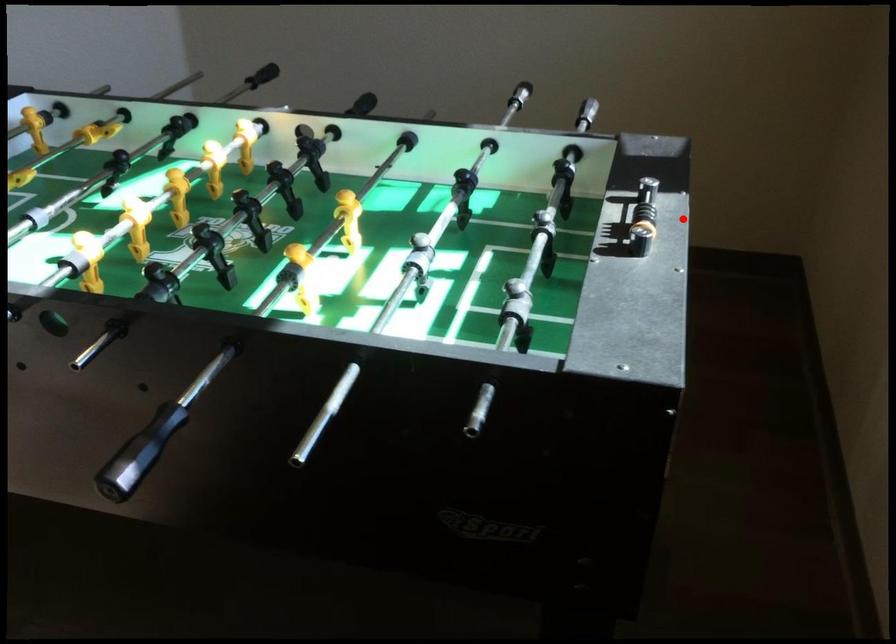
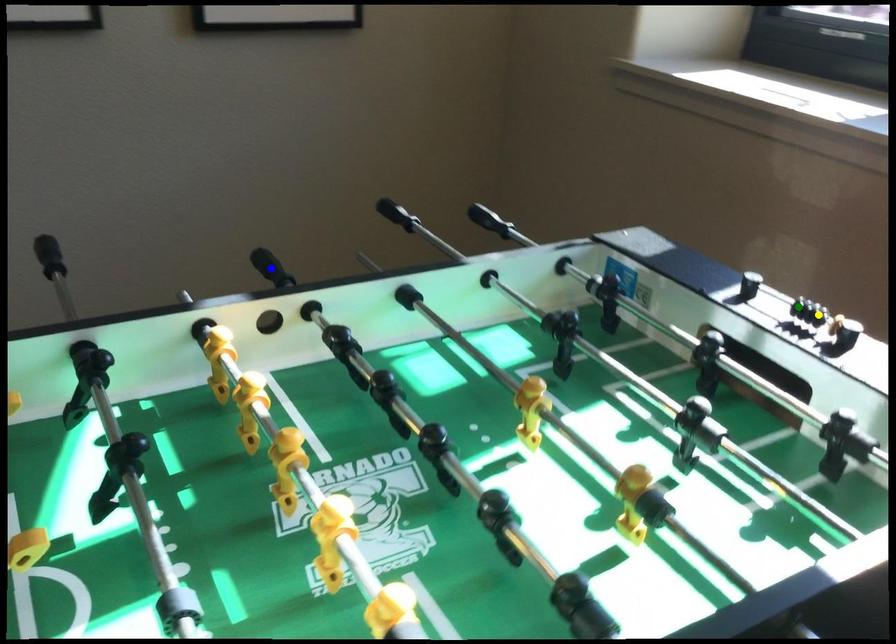
Question: I am providing you with two images of the same scene from different viewpoints. A red point is marked on the first image. You are given multiple points on the second image. Which point in image 2 represents the same 3d spot as the red point in image 1?

Choices:
 (A) yellow point
 (B) blue point
 (C) green point

Answer: (C)